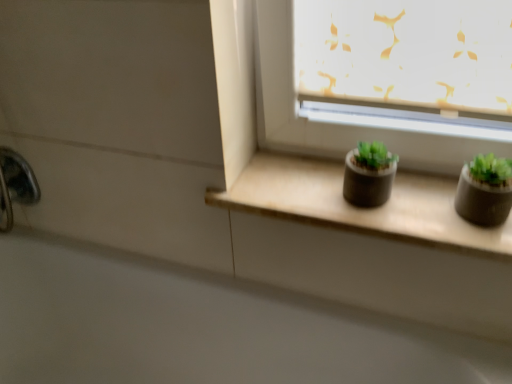
Where is `vacant space that is in between matte black pot at center, the 1th flowerpot viewed from the left, and matte gray flowerpot at right, which ranks as the 1th flowerpot in right-to-left order`? Image resolution: width=512 pixels, height=384 pixels. vacant space that is in between matte black pot at center, the 1th flowerpot viewed from the left, and matte gray flowerpot at right, which ranks as the 1th flowerpot in right-to-left order is located at coordinates (422, 202).